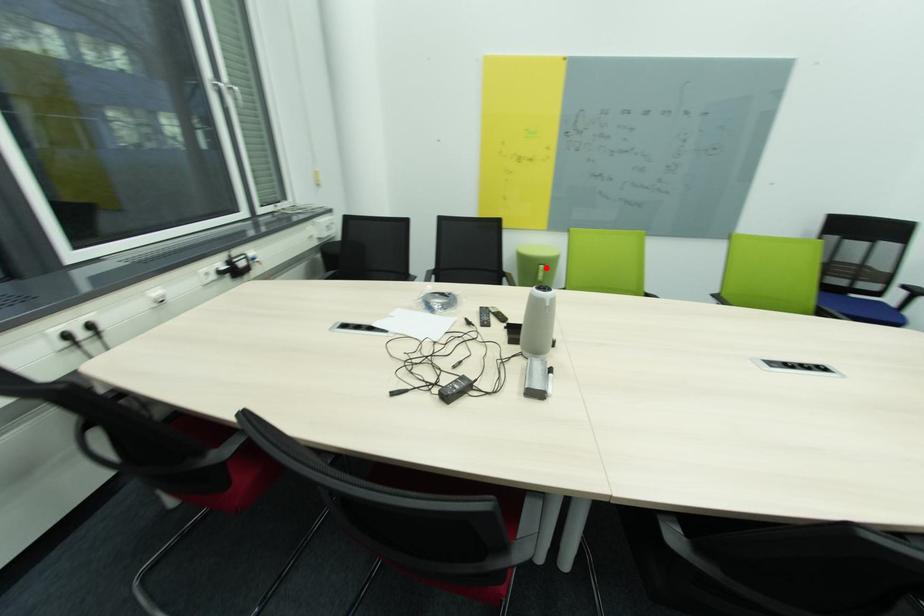
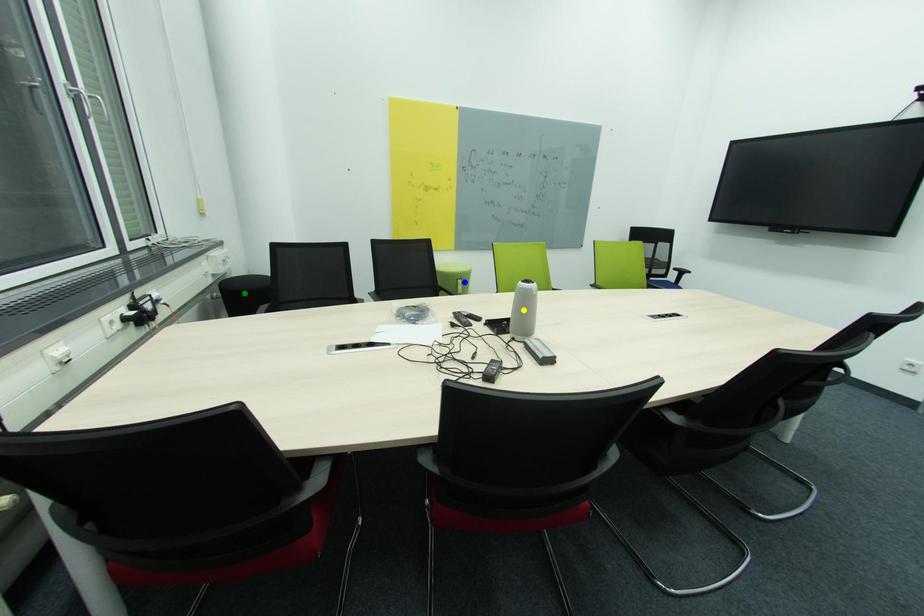
Question: I am providing you with two images of the same scene from different viewpoints. A red point is marked on the first image. You are given multiple points on the second image. Which point in image 2 represents the same 3d spot as the red point in image 1?

Choices:
 (A) yellow point
 (B) green point
 (C) blue point

Answer: (C)